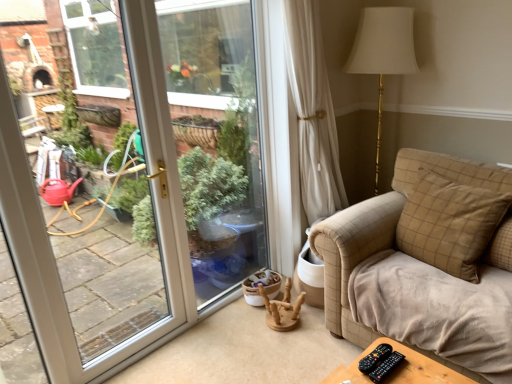
What is the approximate width of black plastic remote at lower right, which ranks as the first remote in right-to-left order?

6.95 inches.

Locate an element on the screen. This screenshot has height=384, width=512. wooden at center is located at coordinates (282, 309).

Image resolution: width=512 pixels, height=384 pixels. Describe the element at coordinates (450, 223) in the screenshot. I see `beige checkered pillow at right, placed as the second pillow when sorted from back to front` at that location.

This screenshot has height=384, width=512. Identify the location of black plastic remote at lower right, which ranks as the first remote in right-to-left order. (386, 367).

Is wooden at center to the left of beige checkered pillow at right, placed as the 2th pillow when sorted from front to back, from the viewer's perspective?

Yes.

How distant is wooden at center from beige checkered pillow at right, which is counted as the first pillow, starting from the back?

wooden at center and beige checkered pillow at right, which is counted as the first pillow, starting from the back, are 1.09 meters apart from each other.

Between wooden at center and beige checkered pillow at right, which is counted as the first pillow, starting from the back, which one has smaller width?

Thinner between the two is beige checkered pillow at right, which is counted as the first pillow, starting from the back.

Between wooden at center and beige checkered pillow at right, which is counted as the first pillow, starting from the back, which one has smaller size?

Smaller between the two is beige checkered pillow at right, which is counted as the first pillow, starting from the back.

Which is in front, wooden at center or beige checkered pillow at right, placed as the second pillow when sorted from back to front?

Positioned in front is beige checkered pillow at right, placed as the second pillow when sorted from back to front.

I want to click on rocking chair lying below the beige checkered pillow at right, placed as the second pillow when sorted from back to front (from the image's perspective), so [x=282, y=309].

Is wooden at center turned away from beige checkered pillow at right, placed as the second pillow when sorted from back to front?

No, beige checkered pillow at right, placed as the second pillow when sorted from back to front, is not at the back of wooden at center.

In terms of width, does beige checkered pillow at right, placed as the 2th pillow when sorted from front to back, look wider or thinner when compared to wooden at center?

Considering their sizes, beige checkered pillow at right, placed as the 2th pillow when sorted from front to back, looks slimmer than wooden at center.

Looking at the image, does beige checkered pillow at right, placed as the 2th pillow when sorted from front to back, seem bigger or smaller compared to wooden at center?

In the image, beige checkered pillow at right, placed as the 2th pillow when sorted from front to back, appears to be smaller than wooden at center.

Does point (488, 252) come in front of point (262, 294)?

Yes, point (488, 252) is closer to viewer.

Is beige checkered pillow at right, which is counted as the first pillow, starting from the back, aimed at wooden at center?

No.

Is black plastic remote at lower right, the 2th remote in the left-to-right sequence, touching black plastic remote at lower right, which ranks as the first remote in left-to-right order?

Yes, black plastic remote at lower right, the 2th remote in the left-to-right sequence, is right next to black plastic remote at lower right, which ranks as the first remote in left-to-right order, and making contact.

Is black plastic remote at lower right, the 2th remote in the left-to-right sequence, taller or shorter than black plastic remote at lower right, which ranks as the first remote in left-to-right order?

black plastic remote at lower right, the 2th remote in the left-to-right sequence, is shorter than black plastic remote at lower right, which ranks as the first remote in left-to-right order.

In terms of size, does black plastic remote at lower right, the 2th remote in the left-to-right sequence, appear bigger or smaller than black plastic remote at lower right, which ranks as the first remote in left-to-right order?

Clearly, black plastic remote at lower right, the 2th remote in the left-to-right sequence, is smaller in size than black plastic remote at lower right, which ranks as the first remote in left-to-right order.

Considering the positions of point (383, 375) and point (375, 362), is point (383, 375) closer or farther from the camera than point (375, 362)?

Point (383, 375) appears to be closer to the viewer than point (375, 362).

Considering the points (362, 372) and (397, 355), which point is behind, point (362, 372) or point (397, 355)?

The point (397, 355) is behind.

Is black plastic remote at lower right, which is counted as the second remote, starting from the right, looking in the opposite direction of black plastic remote at lower right, which ranks as the first remote in right-to-left order?

black plastic remote at lower right, which is counted as the second remote, starting from the right, does not have its back to black plastic remote at lower right, which ranks as the first remote in right-to-left order.

Would you say black plastic remote at lower right, which is counted as the second remote, starting from the right, is outside black plastic remote at lower right, the 2th remote in the left-to-right sequence?

black plastic remote at lower right, which is counted as the second remote, starting from the right, lies outside black plastic remote at lower right, the 2th remote in the left-to-right sequence,'s area.

Considering the sizes of black plastic remote at lower right, the 2th remote in the left-to-right sequence, and beige checkered pillow at right, placed as the second pillow when sorted from back to front, in the image, is black plastic remote at lower right, the 2th remote in the left-to-right sequence, taller or shorter than beige checkered pillow at right, placed as the second pillow when sorted from back to front,?

In the image, black plastic remote at lower right, the 2th remote in the left-to-right sequence, appears to be shorter than beige checkered pillow at right, placed as the second pillow when sorted from back to front.

Which is behind, point (386, 375) or point (499, 222)?

The point (499, 222) is behind.

Does black plastic remote at lower right, which ranks as the first remote in right-to-left order, turn towards beige checkered pillow at right, the 1th pillow viewed from the front?

No, black plastic remote at lower right, which ranks as the first remote in right-to-left order, is not aimed at beige checkered pillow at right, the 1th pillow viewed from the front.

Which of these two, black plastic remote at lower right, which ranks as the first remote in right-to-left order, or beige checkered pillow at right, the 1th pillow viewed from the front, is smaller?

Smaller between the two is black plastic remote at lower right, which ranks as the first remote in right-to-left order.

Looking at this image, which object is more forward, black plastic remote at lower right, which ranks as the first remote in left-to-right order, or beige checkered pillow at right, placed as the 2th pillow when sorted from front to back?

black plastic remote at lower right, which ranks as the first remote in left-to-right order, is more forward.

Between black plastic remote at lower right, which is counted as the second remote, starting from the right, and beige checkered pillow at right, which is counted as the first pillow, starting from the back, which one has more height?

Standing taller between the two is beige checkered pillow at right, which is counted as the first pillow, starting from the back.

Between black plastic remote at lower right, which is counted as the second remote, starting from the right, and beige checkered pillow at right, which is counted as the first pillow, starting from the back, which one appears on the left side from the viewer's perspective?

black plastic remote at lower right, which is counted as the second remote, starting from the right.

Could you measure the distance between black plastic remote at lower right, which ranks as the first remote in left-to-right order, and beige checkered pillow at right, which is counted as the first pillow, starting from the back?

black plastic remote at lower right, which ranks as the first remote in left-to-right order, and beige checkered pillow at right, which is counted as the first pillow, starting from the back, are 35.55 inches apart.

You are a GUI agent. You are given a task and a screenshot of the screen. Output one action in this format:
    pyautogui.click(x=<x>, y=<y>)
    Task: Click on the pillow that is the 2nd one when counting rightward from the wooden at center
    Image resolution: width=512 pixels, height=384 pixels.
    Given the screenshot: What is the action you would take?
    pyautogui.click(x=500, y=246)

Identify the location of the 2nd pillow in front when counting from the wooden at center. This screenshot has height=384, width=512. (450, 223).

Considering their positions, is black plastic remote at lower right, which is counted as the second remote, starting from the right, positioned further to beige checkered pillow at right, placed as the 2th pillow when sorted from front to back, than black plastic remote at lower right, the 2th remote in the left-to-right sequence?

black plastic remote at lower right, which is counted as the second remote, starting from the right, lies further to beige checkered pillow at right, placed as the 2th pillow when sorted from front to back, than the other object.

From the image, which object appears to be nearer to black plastic remote at lower right, which ranks as the first remote in left-to-right order, beige checkered pillow at right, the 1th pillow viewed from the front, or wooden at center?

beige checkered pillow at right, the 1th pillow viewed from the front.

Based on their spatial positions, is beige checkered pillow at right, placed as the 2th pillow when sorted from front to back, or beige checkered pillow at right, placed as the second pillow when sorted from back to front, closer to black plastic remote at lower right, which ranks as the first remote in right-to-left order?

The object closer to black plastic remote at lower right, which ranks as the first remote in right-to-left order, is beige checkered pillow at right, placed as the second pillow when sorted from back to front.

Consider the image. When comparing their distances from black plastic remote at lower right, which ranks as the first remote in right-to-left order, does beige checkered pillow at right, placed as the 2th pillow when sorted from front to back, or black plastic remote at lower right, which ranks as the first remote in left-to-right order, seem closer?

The object closer to black plastic remote at lower right, which ranks as the first remote in right-to-left order, is black plastic remote at lower right, which ranks as the first remote in left-to-right order.

From the image, which object appears to be farther from black plastic remote at lower right, which is counted as the second remote, starting from the right, black plastic remote at lower right, which ranks as the first remote in right-to-left order, or wooden at center?

wooden at center is further to black plastic remote at lower right, which is counted as the second remote, starting from the right.

From the picture: When comparing their distances from wooden at center, does beige checkered pillow at right, placed as the second pillow when sorted from back to front, or black plastic remote at lower right, which is counted as the second remote, starting from the right, seem further?

black plastic remote at lower right, which is counted as the second remote, starting from the right, is further to wooden at center.

Looking at this image, from the image, which object appears to be nearer to beige checkered pillow at right, placed as the 2th pillow when sorted from front to back, wooden at center or beige checkered pillow at right, placed as the second pillow when sorted from back to front?

Based on the image, beige checkered pillow at right, placed as the second pillow when sorted from back to front, appears to be nearer to beige checkered pillow at right, placed as the 2th pillow when sorted from front to back.

Based on their spatial positions, is black plastic remote at lower right, which ranks as the first remote in left-to-right order, or beige checkered pillow at right, the 1th pillow viewed from the front, further from black plastic remote at lower right, which ranks as the first remote in right-to-left order?

Based on the image, beige checkered pillow at right, the 1th pillow viewed from the front, appears to be further to black plastic remote at lower right, which ranks as the first remote in right-to-left order.

The height and width of the screenshot is (384, 512). Identify the location of remote between black plastic remote at lower right, which ranks as the first remote in right-to-left order, and wooden at center from front to back. (375, 358).

At what (x,y) coordinates should I click in order to perform the action: click on pillow located between black plastic remote at lower right, which is counted as the second remote, starting from the right, and beige checkered pillow at right, placed as the 2th pillow when sorted from front to back, in the left-right direction. Please return your answer as a coordinate pair (x, y). This screenshot has height=384, width=512. Looking at the image, I should click on (450, 223).

This screenshot has height=384, width=512. I want to click on remote situated between black plastic remote at lower right, which is counted as the second remote, starting from the right, and beige checkered pillow at right, placed as the 2th pillow when sorted from front to back, from left to right, so click(x=386, y=367).

Identify the location of remote between black plastic remote at lower right, which is counted as the second remote, starting from the right, and beige checkered pillow at right, placed as the second pillow when sorted from back to front. [386, 367].